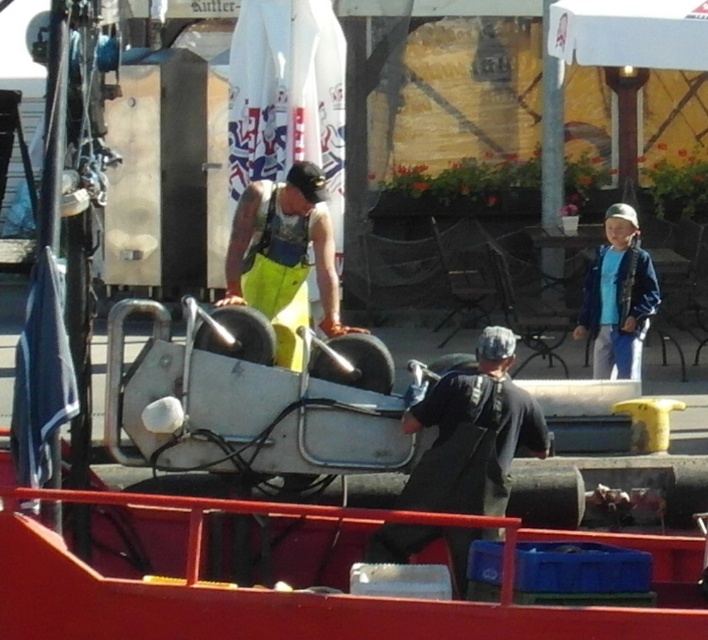
Question: Considering the relative positions of dark gray fabric jacket at center and blue denim jacket at right in the image provided, where is dark gray fabric jacket at center located with respect to blue denim jacket at right?

Choices:
 (A) below
 (B) above

Answer: (A)

Question: Is dark gray fabric jacket at center positioned before yellow fabric worker at center?

Choices:
 (A) yes
 (B) no

Answer: (A)

Question: Which object is farther from the camera taking this photo?

Choices:
 (A) blue denim jacket at right
 (B) dark gray fabric jacket at center

Answer: (A)

Question: Which object appears farthest from the camera in this image?

Choices:
 (A) yellow fabric worker at center
 (B) blue denim jacket at right

Answer: (B)

Question: Is yellow fabric worker at center wider than blue denim jacket at right?

Choices:
 (A) no
 (B) yes

Answer: (B)

Question: Estimate the real-world distances between objects in this image. Which object is farther from the yellow fabric worker at center?

Choices:
 (A) dark gray fabric jacket at center
 (B) blue denim jacket at right

Answer: (B)